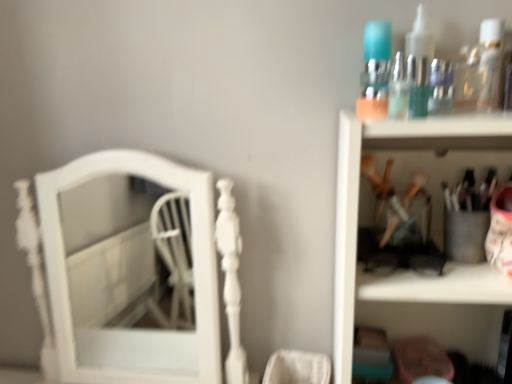
Question: Is clear plastic bottle at upper right at the left side of metallic silver utensils at upper right?

Choices:
 (A) no
 (B) yes

Answer: (A)

Question: Is clear plastic bottle at upper right positioned with its back to metallic silver utensils at upper right?

Choices:
 (A) yes
 (B) no

Answer: (B)

Question: From the image's perspective, is clear plastic bottle at upper right beneath metallic silver utensils at upper right?

Choices:
 (A) no
 (B) yes

Answer: (A)

Question: Is clear plastic bottle at upper right further to camera compared to metallic silver utensils at upper right?

Choices:
 (A) yes
 (B) no

Answer: (A)

Question: Does clear plastic bottle at upper right have a greater height compared to metallic silver utensils at upper right?

Choices:
 (A) no
 (B) yes

Answer: (A)

Question: From the image's perspective, is clear plastic bottle at upper right located above or below metallic silver utensils at upper right?

Choices:
 (A) above
 (B) below

Answer: (A)

Question: Is clear plastic bottle at upper right to the left or to the right of metallic silver utensils at upper right in the image?

Choices:
 (A) right
 (B) left

Answer: (A)

Question: From a real-world perspective, is clear plastic bottle at upper right positioned above or below metallic silver utensils at upper right?

Choices:
 (A) above
 (B) below

Answer: (A)

Question: Considering the positions of clear plastic bottle at upper right and metallic silver utensils at upper right in the image, is clear plastic bottle at upper right bigger or smaller than metallic silver utensils at upper right?

Choices:
 (A) big
 (B) small

Answer: (B)

Question: Relative to white glossy mirror at left, is translucent glass bottles at upper right in front or behind?

Choices:
 (A) behind
 (B) front

Answer: (B)

Question: In terms of size, does translucent glass bottles at upper right appear bigger or smaller than white glossy mirror at left?

Choices:
 (A) small
 (B) big

Answer: (A)

Question: Is point (377, 112) positioned closer to the camera than point (98, 379)?

Choices:
 (A) farther
 (B) closer

Answer: (B)

Question: Considering the relative positions of translucent glass bottles at upper right and white glossy mirror at left in the image provided, is translucent glass bottles at upper right to the left or to the right of white glossy mirror at left?

Choices:
 (A) left
 (B) right

Answer: (B)

Question: From the image's perspective, is white glossy mirror at left positioned above or below clear plastic bottle at upper right?

Choices:
 (A) above
 (B) below

Answer: (B)

Question: Considering the positions of white glossy mirror at left and clear plastic bottle at upper right in the image, is white glossy mirror at left wider or thinner than clear plastic bottle at upper right?

Choices:
 (A) thin
 (B) wide

Answer: (B)